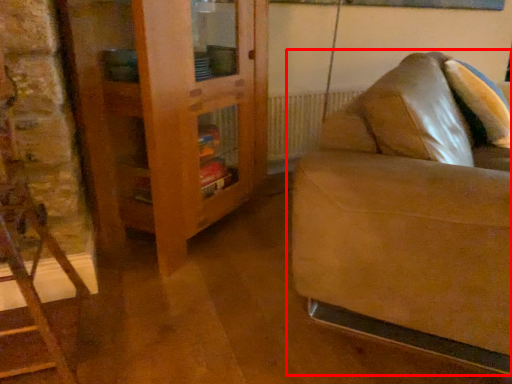
Question: In this image, where is studio couch (annotated by the red box) located relative to dresser?

Choices:
 (A) left
 (B) right

Answer: (B)